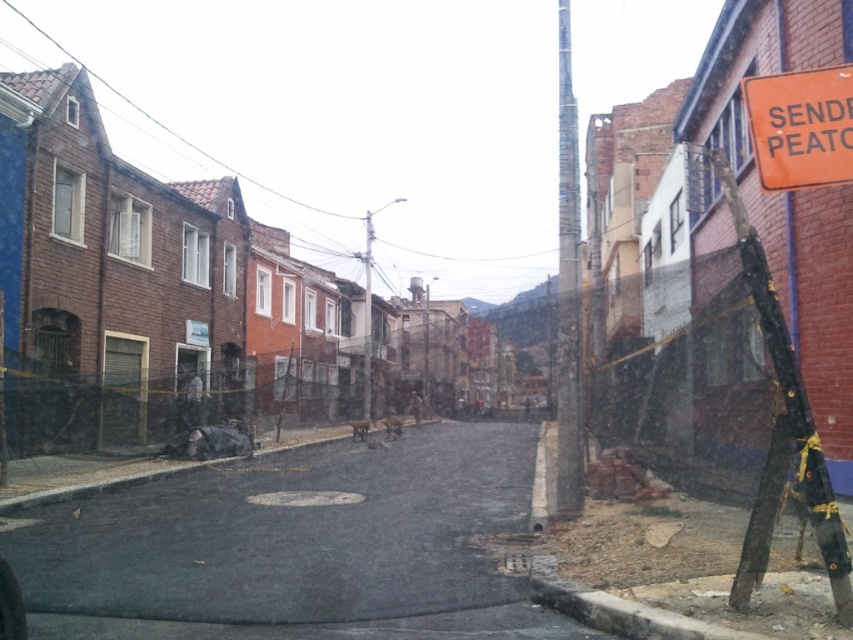
Question: Is dark asphalt road at center wider than orange plastic sign at upper right?

Choices:
 (A) yes
 (B) no

Answer: (A)

Question: Which of the following is the closest to the observer?

Choices:
 (A) (761, 170)
 (B) (276, 524)

Answer: (A)

Question: Which point is farther to the camera?

Choices:
 (A) (328, 634)
 (B) (793, 113)

Answer: (A)

Question: Can you confirm if dark asphalt road at center is bigger than orange plastic sign at upper right?

Choices:
 (A) no
 (B) yes

Answer: (B)

Question: Considering the relative positions of dark asphalt road at center and orange plastic sign at upper right in the image provided, where is dark asphalt road at center located with respect to orange plastic sign at upper right?

Choices:
 (A) above
 (B) below

Answer: (B)